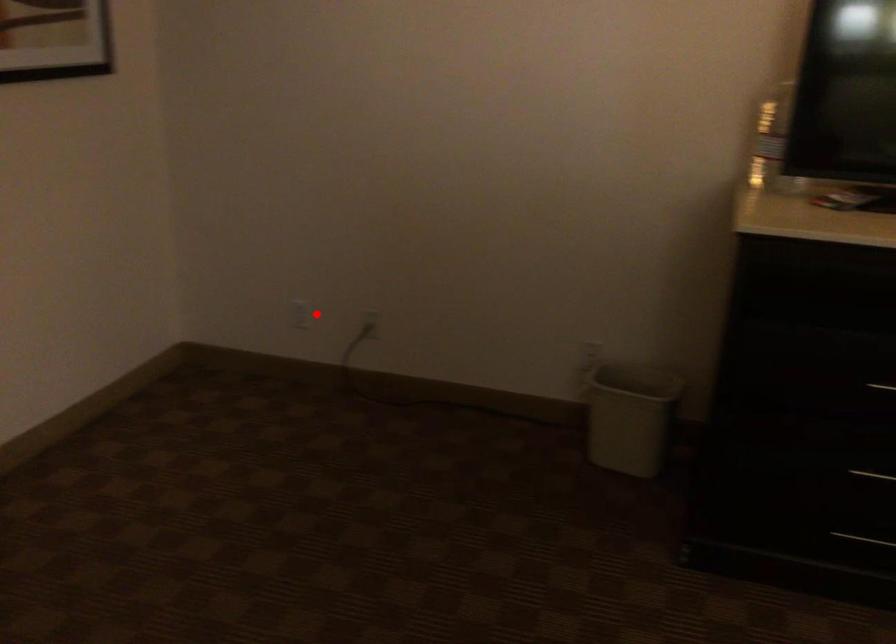
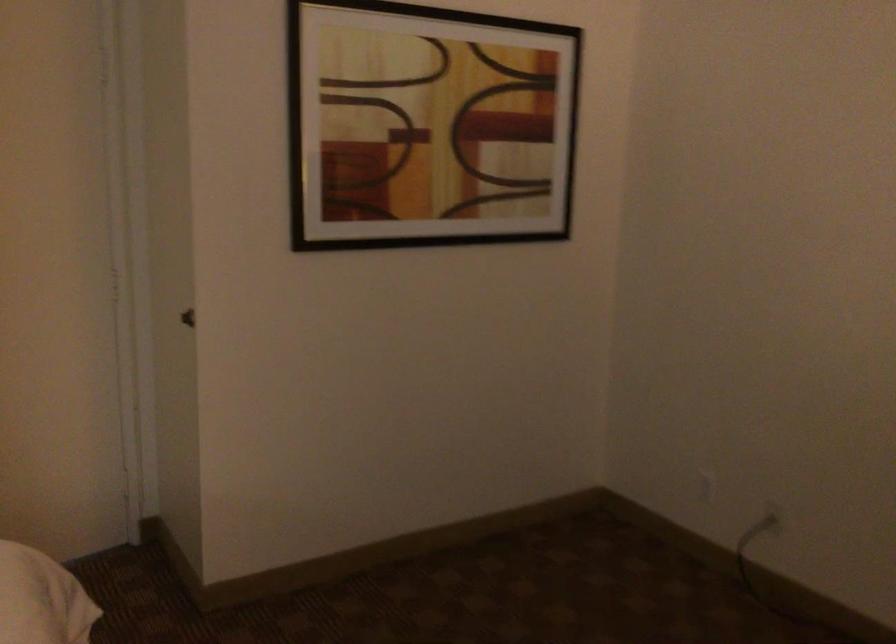
In the second image, find the point that corresponds to the highlighted location in the first image.

(707, 487)